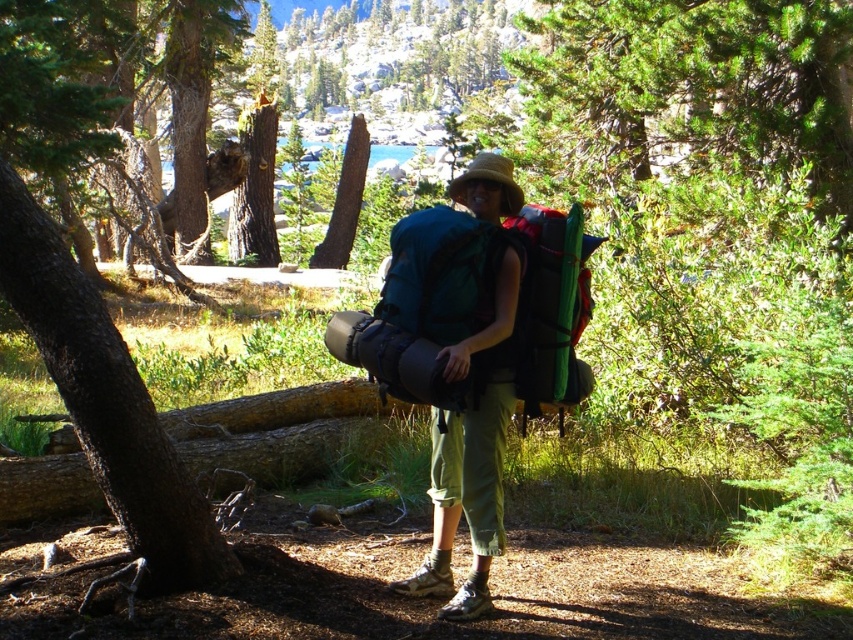
You are a hiker who just arrived at the forest area. You need to place your matte blue backpack at center exactly 6 meters away from the dark brown bark at left. Based on the scene, can you do that?

The distance between dark brown bark at left and matte blue backpack at center is 5.71 meters, which is less than 6 meters. Therefore, you cannot place the matte blue backpack at center exactly 6 meters away from the dark brown bark at left with the current positioning.

You are a hiker who just arrived at the forest area. You notice the dark brown bark at left and the matte blue backpack at center. Which object takes up more space in the image?

The dark brown bark at left is larger in size than the matte blue backpack at center, so it takes up more space in the image.